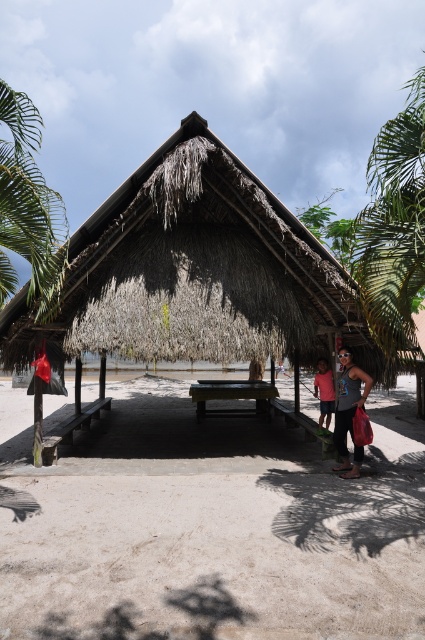
Can you confirm if light brown sandy beach at lower center is taller than thatched roof hut at center?

In fact, light brown sandy beach at lower center may be shorter than thatched roof hut at center.

Between point (139, 524) and point (212, 208), which one is positioned in front?

Point (139, 524)

Find the location of `light brown sandy beach at lower center`. light brown sandy beach at lower center is located at coordinates (215, 557).

Is light brown sandy beach at lower center wider than matte black sunglasses at lower right?

Indeed, light brown sandy beach at lower center has a greater width compared to matte black sunglasses at lower right.

Does light brown sandy beach at lower center appear on the left side of matte black sunglasses at lower right?

Indeed, light brown sandy beach at lower center is positioned on the left side of matte black sunglasses at lower right.

Does point (102, 525) lie in front of point (343, 461)?

Yes, it is.

Where is `light brown sandy beach at lower center`? The width and height of the screenshot is (425, 640). light brown sandy beach at lower center is located at coordinates (215, 557).

Can you confirm if light brown sandy beach at lower center is positioned below matte pink shirt at lower right?

Correct, light brown sandy beach at lower center is located below matte pink shirt at lower right.

Is light brown sandy beach at lower center shorter than matte pink shirt at lower right?

Yes, light brown sandy beach at lower center is shorter than matte pink shirt at lower right.

Between point (19, 557) and point (322, 394), which one is positioned in front?

Point (19, 557) is more forward.

This screenshot has width=425, height=640. What are the coordinates of `light brown sandy beach at lower center` in the screenshot? It's located at (215, 557).